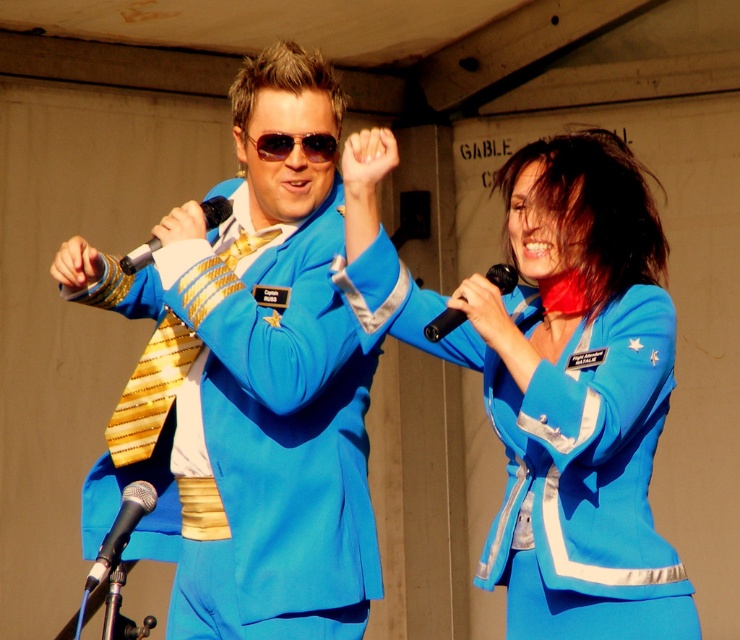
Is black metallic microphone at center below black plastic microphone at center?

Incorrect, black metallic microphone at center is not positioned below black plastic microphone at center.

Where is `black metallic microphone at center`? black metallic microphone at center is located at coordinates (138, 257).

Identify the location of black metallic microphone at center. (138, 257).

You are a GUI agent. You are given a task and a screenshot of the screen. Output one action in this format:
    pyautogui.click(x=<x>, y=<y>)
    Task: Click on the black metallic microphone at center
    Image resolution: width=740 pixels, height=640 pixels.
    Given the screenshot: What is the action you would take?
    pyautogui.click(x=138, y=257)

Which is above, gold shiny tie at center or black metallic microphone at center?

Positioned higher is black metallic microphone at center.

Can you confirm if gold shiny tie at center is bigger than black metallic microphone at center?

Indeed, gold shiny tie at center has a larger size compared to black metallic microphone at center.

Which is behind, point (154, 378) or point (127, 268)?

Positioned behind is point (154, 378).

Identify the location of gold shiny tie at center. The height and width of the screenshot is (640, 740). (149, 392).

In the scene shown: Can you confirm if matte blue suit at center is positioned to the left of blue satin suit at center?

Correct, you'll find matte blue suit at center to the left of blue satin suit at center.

Is point (363, 608) farther from camera compared to point (354, 253)?

Yes, it is behind point (354, 253).

The width and height of the screenshot is (740, 640). What do you see at coordinates (255, 380) in the screenshot?
I see `matte blue suit at center` at bounding box center [255, 380].

What are the coordinates of `matte blue suit at center` in the screenshot? It's located at (255, 380).